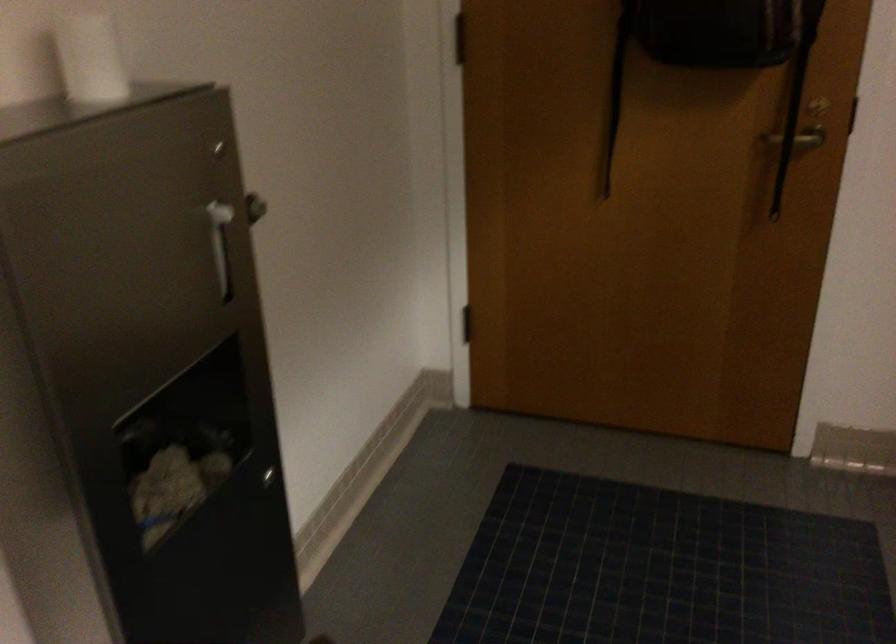
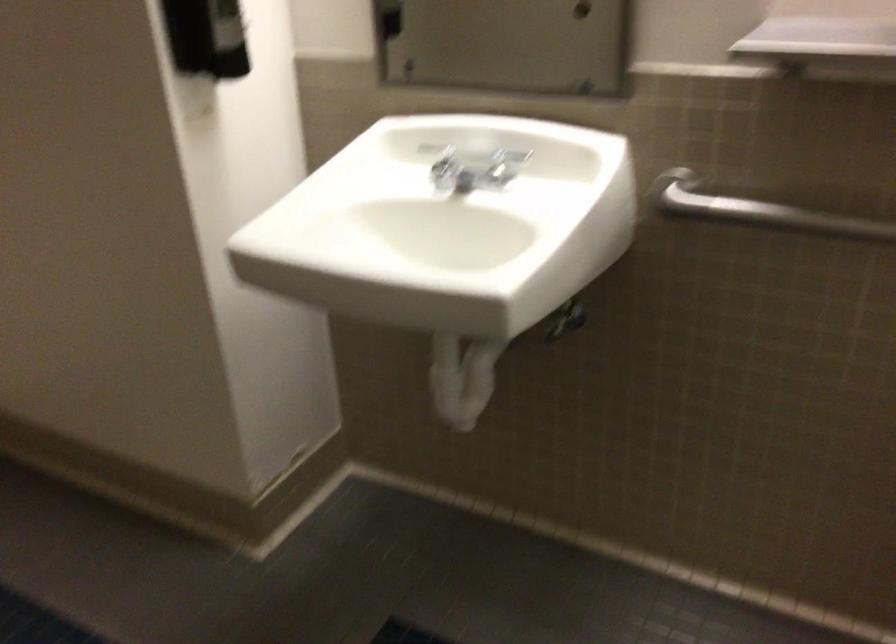
From the picture: First-person continuous shooting, in which direction is the camera rotating?

The camera rotated toward right-down.